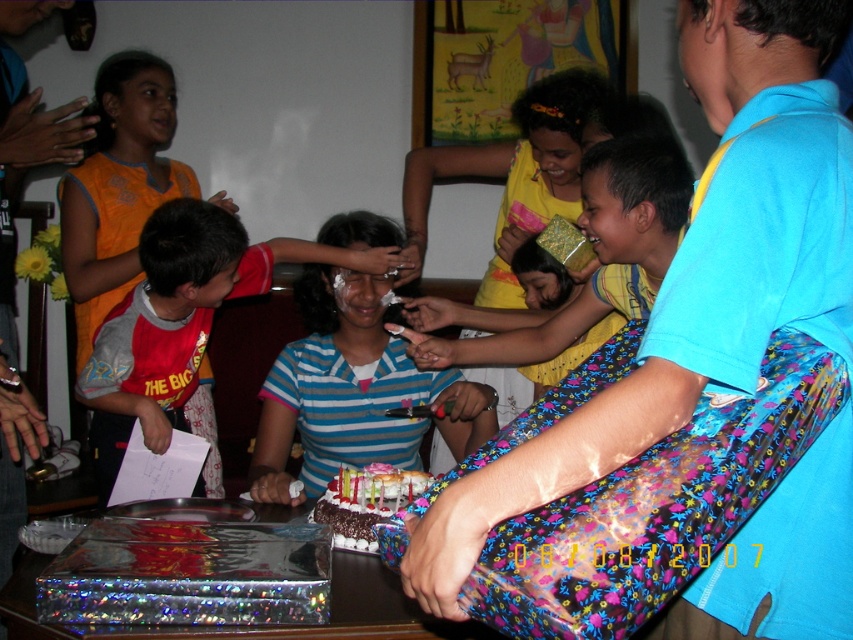
You are a photographer at the birthday party. You want to take a photo of the shiny metallic table at center and the blue striped shirt at center. Which object should you place on the left side of your camera frame to ensure both are in the shot?

You should place the shiny metallic table at center on the left side of your camera frame because the blue striped shirt at center is to the right of it, ensuring both are captured in the shot.

You are a photographer at the birthday party and want to take a photo of both the blue striped shirt at center and the striped cotton shirt at center. Since you can only focus on one shirt at a time, which shirt should you focus on first if you want to capture them in the correct left to right order?

The striped cotton shirt at center is on the left side, so you should focus on it first to maintain the correct left to right order.